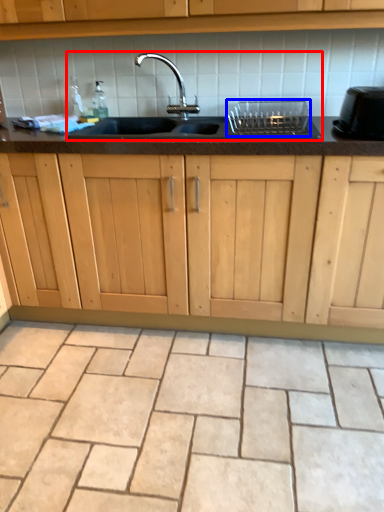
Question: Which object appears closest to the camera in this image, sink (highlighted by a red box) or appliance (highlighted by a blue box)?

Choices:
 (A) sink
 (B) appliance

Answer: (A)